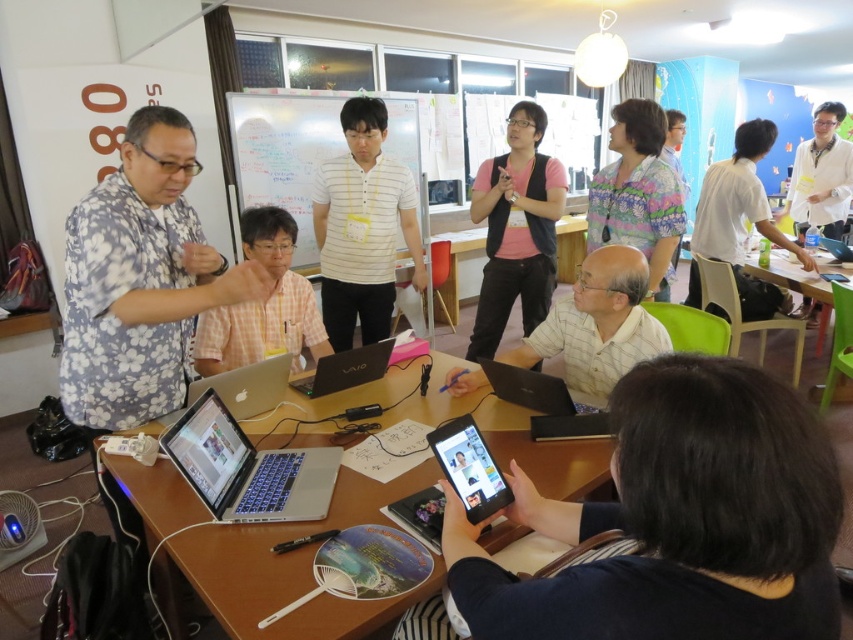
Question: Does white shirt at right appear on the left side of glossy black laptop at center?

Choices:
 (A) yes
 (B) no

Answer: (A)

Question: Does white striped polo shirt at center appear under white shirt at right?

Choices:
 (A) no
 (B) yes

Answer: (B)

Question: Which point appears farthest from the camera in this image?

Choices:
 (A) (462, 452)
 (B) (779, 262)
 (C) (734, 196)

Answer: (B)

Question: Does printed fabric shirt at upper right have a lesser width compared to white lab coat at right?

Choices:
 (A) no
 (B) yes

Answer: (B)

Question: Which object is the farthest from the pink checkered shirt at center?

Choices:
 (A) patterned fabric shirt at center
 (B) matte yellow shirt at center
 (C) matte black laptop at center

Answer: (A)

Question: Among these objects, which one is farthest from the camera?

Choices:
 (A) black glossy laptop at center
 (B) black glossy tablet at center
 (C) matte yellow shirt at center
 (D) matte black tablet at center

Answer: (A)